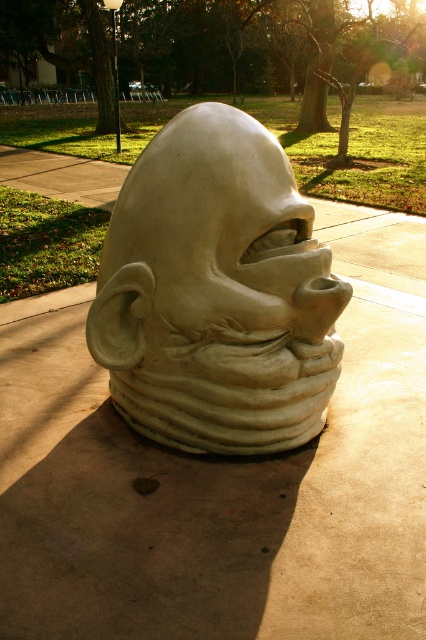
You are an art student analyzing the sculpture in the park. You observe the white matte sculpture at center and the matte clay face at center. Which object is positioned lower in the image?

The white matte sculpture at center is located below the matte clay face at center, so it is positioned lower in the image.

You are an art student trying to measure the distance between the white matte sculpture at center and the matte clay face at center for your project. According to the image, how far apart are these two objects?

The white matte sculpture at center is 2.25 inches from the matte clay face at center, so the distance between them is 2.25 inches.